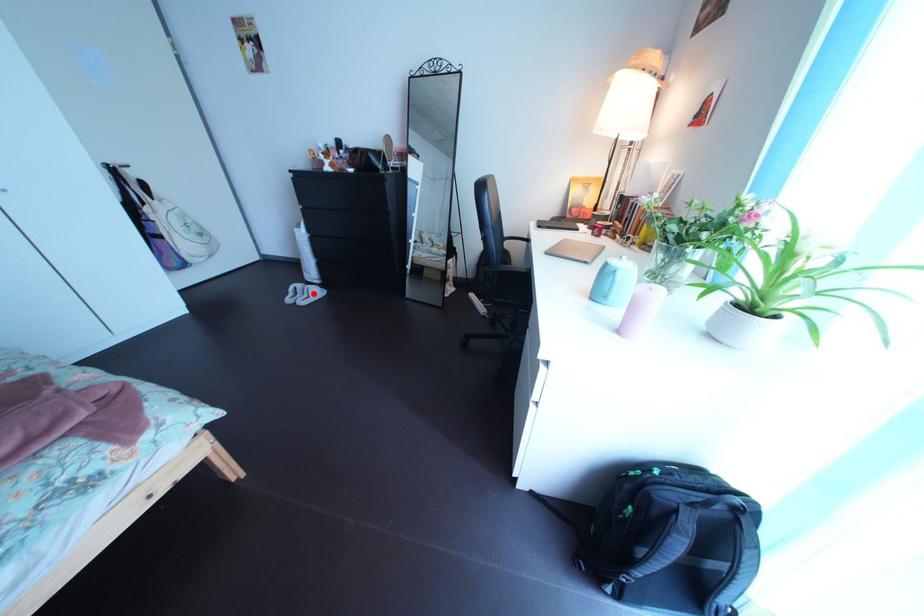
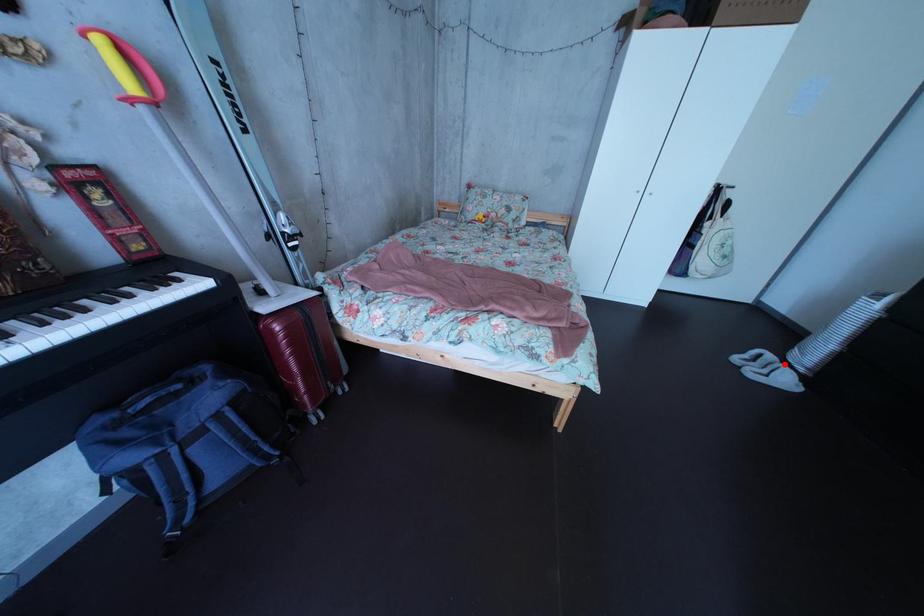
I am providing you with two images of the same scene from different viewpoints. A red point is marked on the first image and another point is marked on the second image. Is the marked point in image1 the same physical position as the marked point in image2?

Yes